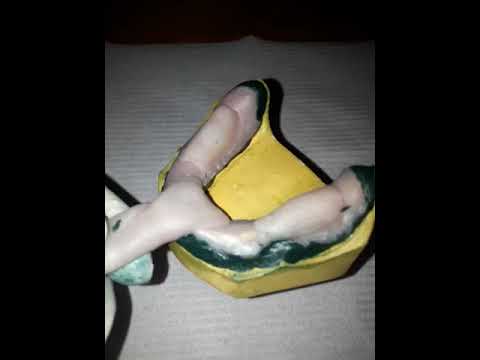
Locate an element on the screen. looks like a yellow dustpan without a handle is located at coordinates (257, 195).